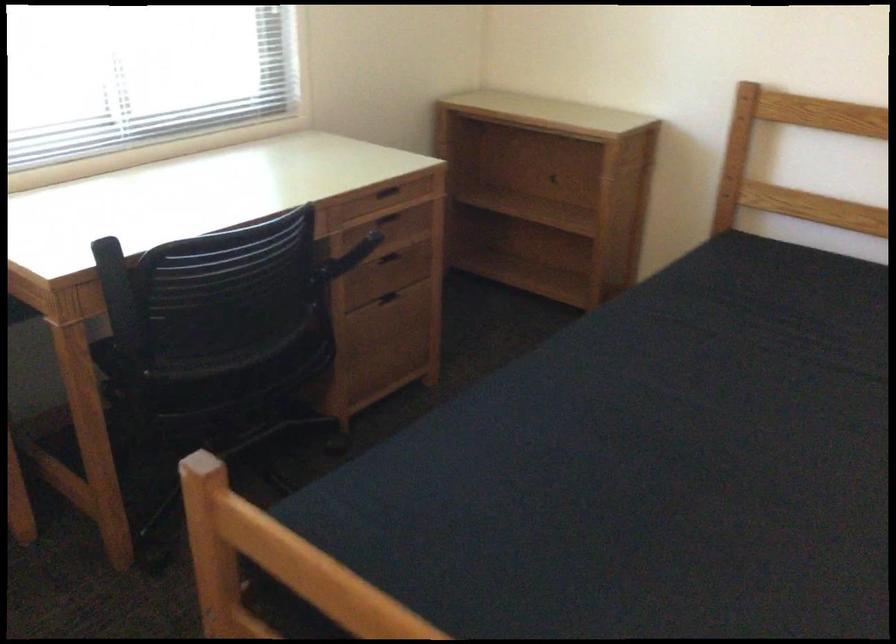
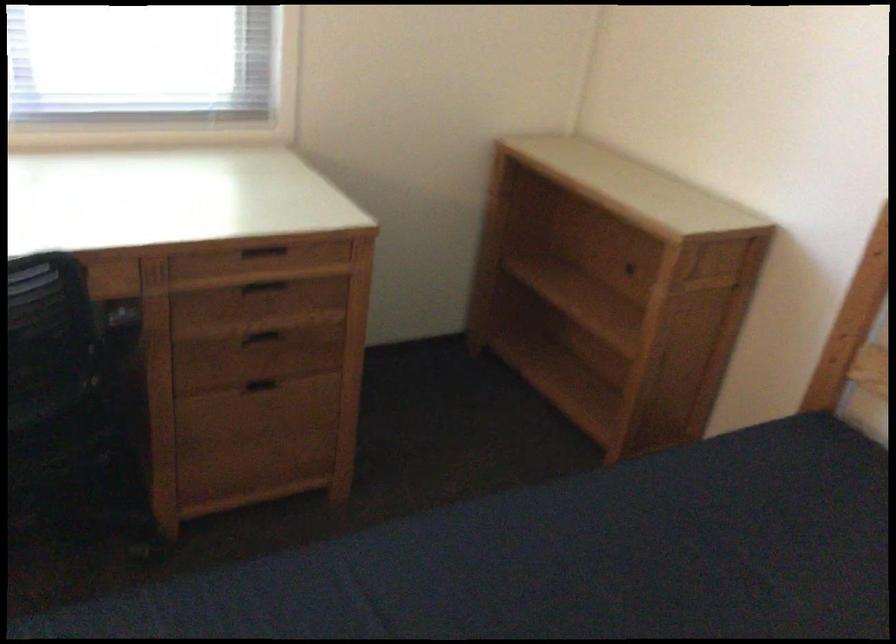
What movement of the cameraman would produce the second image?

The cameraman walked toward right, forward.